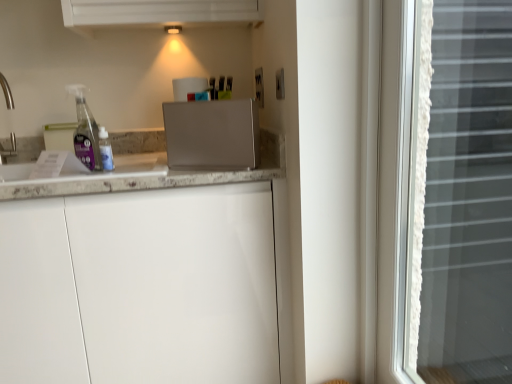
Identify the location of vacant space that is to the left of satin silver toaster at center. (150, 172).